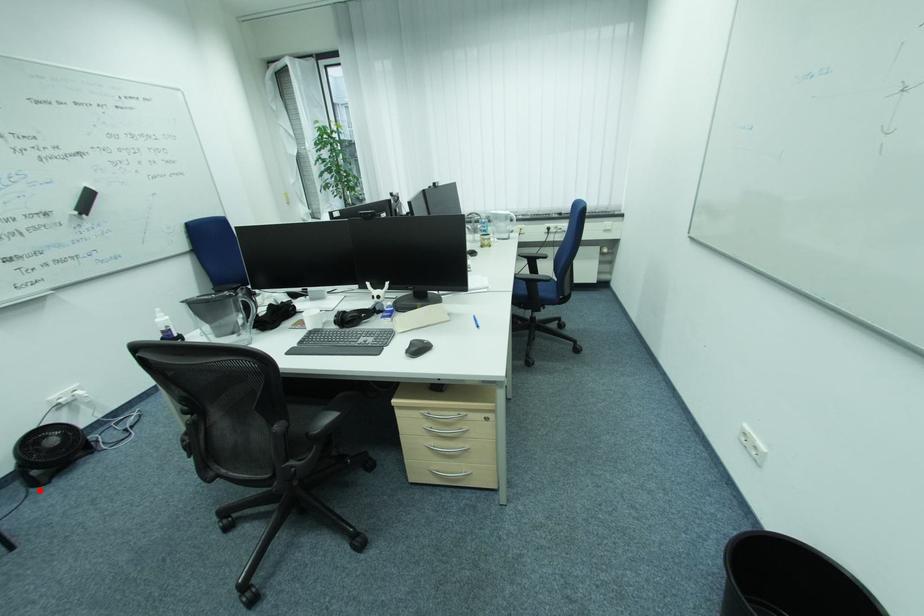
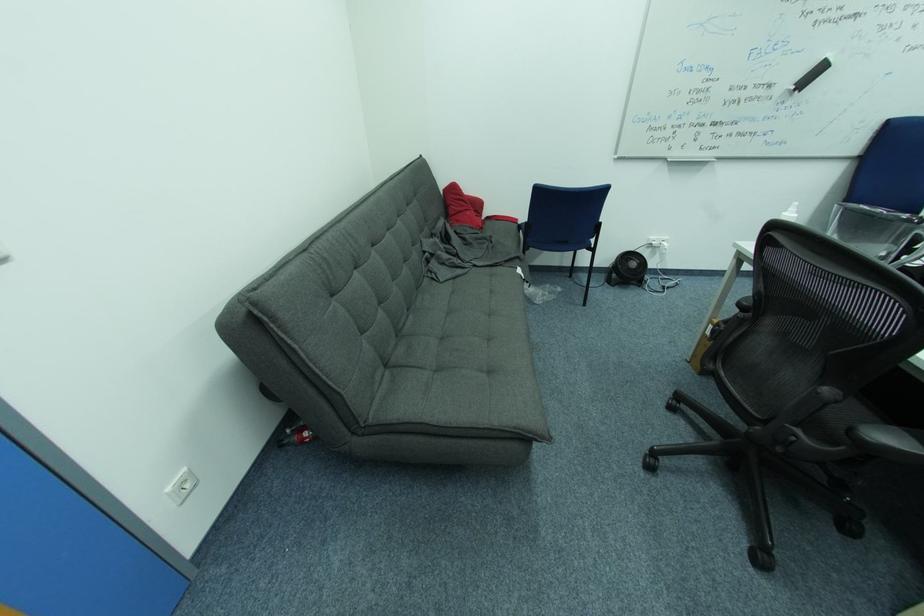
The point at the highlighted location is marked in the first image. Where is the corresponding point in the second image?

(613, 285)